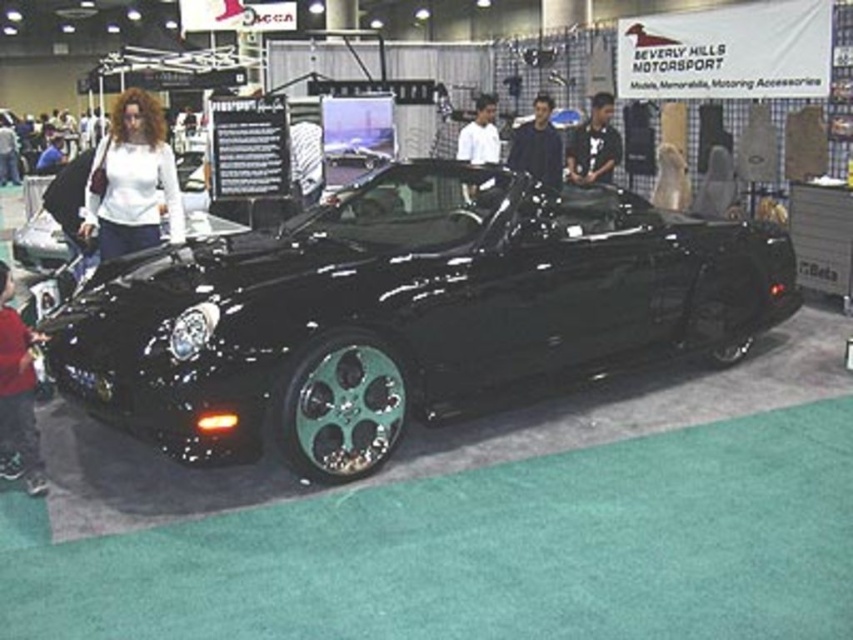
Between point (96, 221) and point (21, 394), which one is positioned behind?

The point (96, 221) is more distant.

Does white fabric shirt at upper left appear on the left side of matte black jacket at lower left?

Indeed, white fabric shirt at upper left is positioned on the left side of matte black jacket at lower left.

Which is behind, point (114, 212) or point (9, 380)?

Positioned behind is point (114, 212).

The width and height of the screenshot is (853, 640). I want to click on white fabric shirt at upper left, so click(x=132, y=180).

Is black leather jacket at center below white matte shirt at center?

Correct, black leather jacket at center is located below white matte shirt at center.

You are a GUI agent. You are given a task and a screenshot of the screen. Output one action in this format:
    pyautogui.click(x=<x>, y=<y>)
    Task: Click on the black leather jacket at center
    
    Given the screenshot: What is the action you would take?
    pyautogui.click(x=537, y=145)

Locate an element on the screen. The height and width of the screenshot is (640, 853). black leather jacket at center is located at coordinates (537, 145).

Is the position of glossy black car at center more distant than that of white matte shirt at center?

No, glossy black car at center is in front of white matte shirt at center.

Is point (792, 304) in front of point (467, 196)?

No.

Image resolution: width=853 pixels, height=640 pixels. I want to click on glossy black car at center, so click(x=403, y=310).